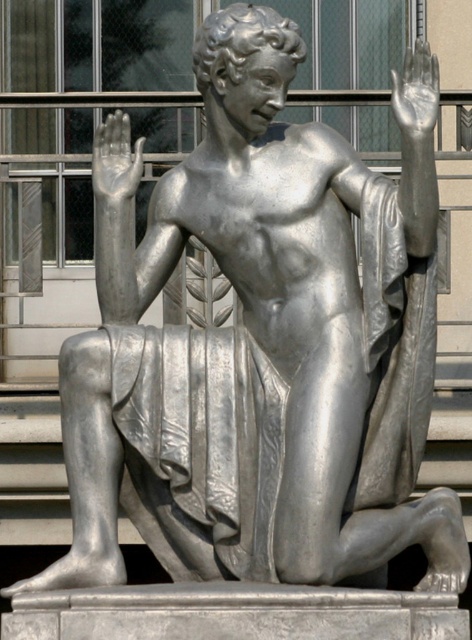
You are an art student analyzing the statue. You notice two hands on the statue, the silver metallic hand at upper left and the metallic silver hand at upper right. Which hand is positioned lower on the statue?

The silver metallic hand at upper left is positioned below the metallic silver hand at upper right, so it is lower on the statue.

You are an art conservator examining the statue. You notice two hands on the statue, the silver metallic hand at upper left and the metallic silver hand at upper right. Which hand has a larger width?

The metallic silver hand at upper right has a larger width than the silver metallic hand at upper left.